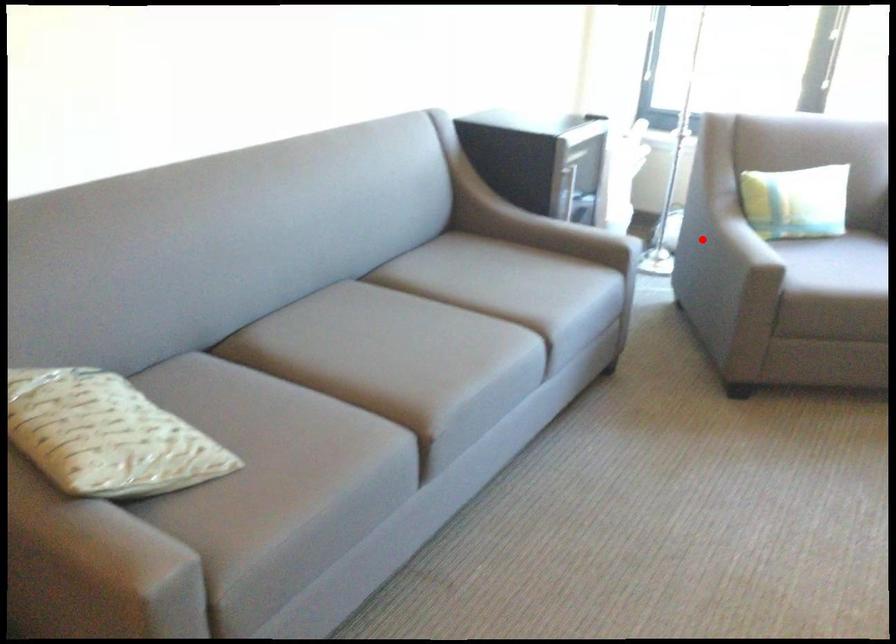
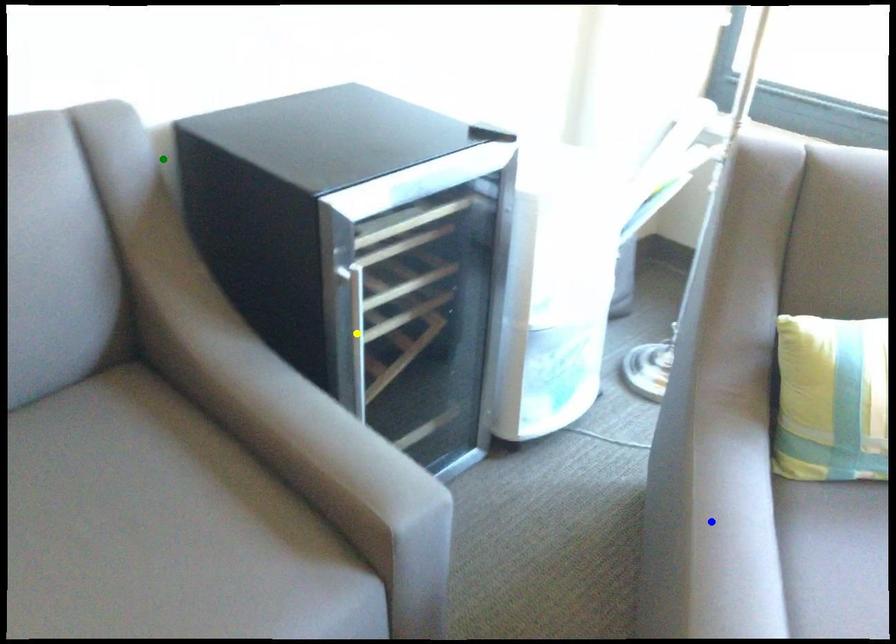
Question: I am providing you with two images of the same scene from different viewpoints. A red point is marked on the first image. You are given multiple points on the second image. In image 2, which mark is for the same physical point as the one in image 1?

Choices:
 (A) blue point
 (B) yellow point
 (C) green point

Answer: (A)